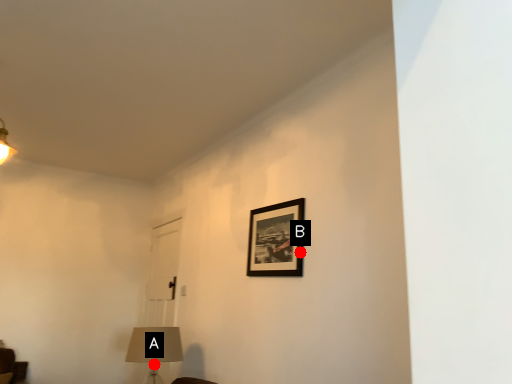
Question: Two points are circled on the image, labeled by A and B beside each circle. Among these points, which one is nearest to the camera?

Choices:
 (A) A is closer
 (B) B is closer

Answer: (B)